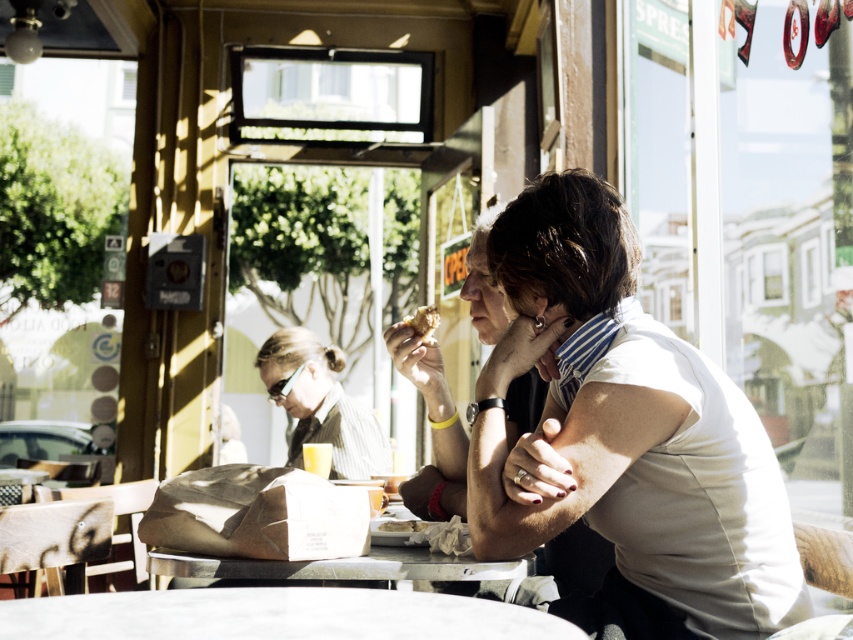
Question: Among these points, which one is nearest to the camera?

Choices:
 (A) (450, 577)
 (B) (167, 618)

Answer: (B)

Question: Which is farther from the white matte shirt at center?

Choices:
 (A) golden crispy pastry at center
 (B) matte black shirt at center

Answer: (A)

Question: Observing the image, what is the correct spatial positioning of white matte shirt at center in reference to matte black shirt at center?

Choices:
 (A) left
 (B) right

Answer: (B)

Question: Is white marble table at center below golden crispy pastry at center?

Choices:
 (A) yes
 (B) no

Answer: (A)

Question: Does white marble table at center appear on the right side of metallic reflective table at center?

Choices:
 (A) yes
 (B) no

Answer: (B)

Question: Considering the real-world distances, which object is farthest from the white matte shirt at center?

Choices:
 (A) white marble table at center
 (B) matte black sunglasses at center
 (C) metallic reflective table at center

Answer: (B)